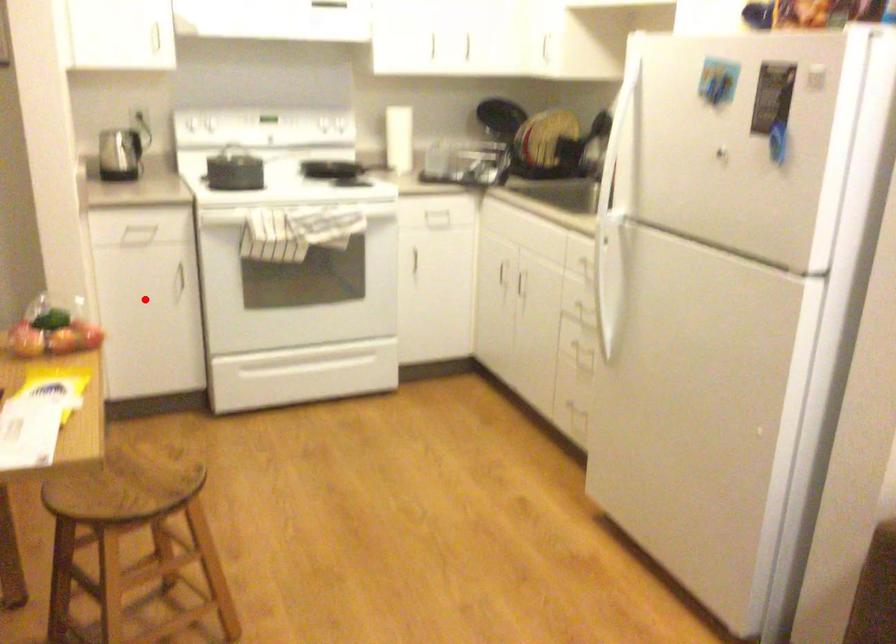
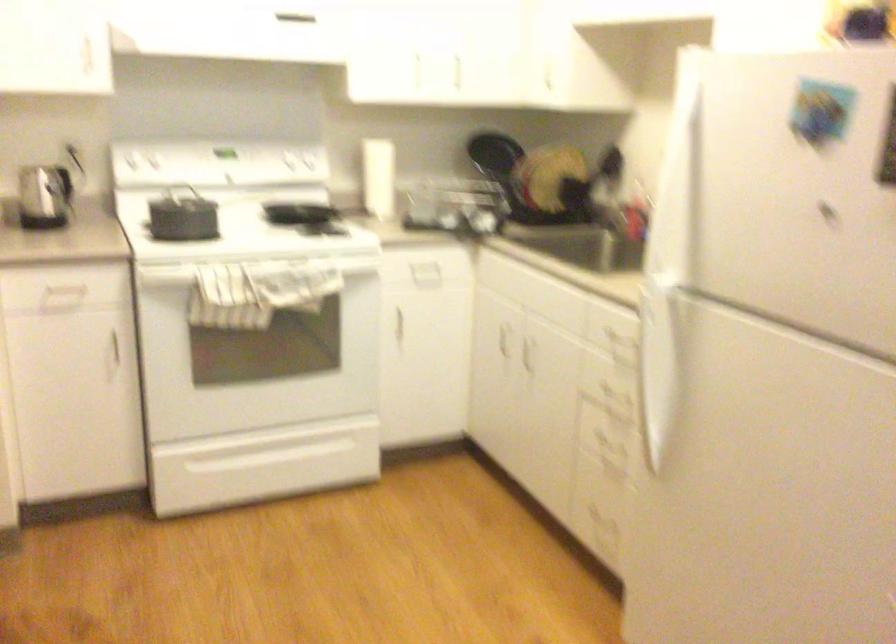
Question: I am providing you with two images of the same scene from different viewpoints. Given a red point in image1, look at the same physical point in image2. Is it:

Choices:
 (A) Closer to the viewpoint
 (B) Farther from the viewpoint

Answer: (A)